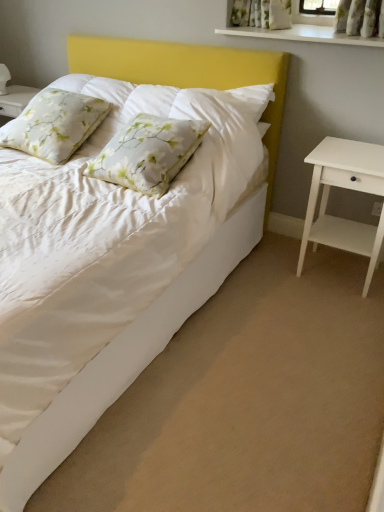
The width and height of the screenshot is (384, 512). Identify the location of free point above white satin bed at lower left (from a real-world perspective). (255, 357).